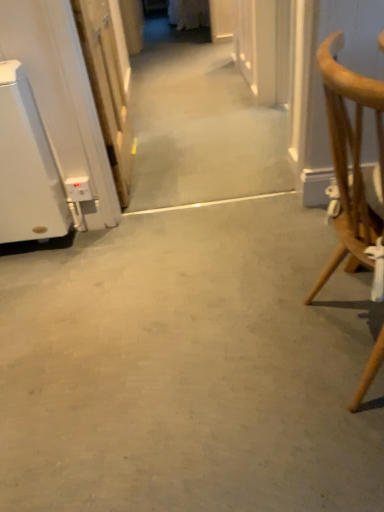
Image resolution: width=384 pixels, height=512 pixels. What do you see at coordinates (351, 156) in the screenshot?
I see `light brown wooden chair at right` at bounding box center [351, 156].

In order to click on light brown wooden chair at right in this screenshot , I will do `click(351, 156)`.

Is gray concrete floor at center oriented away from light brown wooden chair at right?

No, gray concrete floor at center's orientation is not away from light brown wooden chair at right.

Is gray concrete floor at center next to light brown wooden chair at right?

No, gray concrete floor at center is not in contact with light brown wooden chair at right.

From the image's perspective, is gray concrete floor at center above or below light brown wooden chair at right?

gray concrete floor at center is below light brown wooden chair at right.

Can you tell me how much gray concrete floor at center and light brown wooden chair at right differ in facing direction?

89 degrees.

Considering the positions of objects white glossy door at left and gray concrete floor at center in the image provided, who is behind, white glossy door at left or gray concrete floor at center?

white glossy door at left is more distant.

Can you confirm if white glossy door at left is smaller than gray concrete floor at center?

Indeed, white glossy door at left has a smaller size compared to gray concrete floor at center.

Identify the location of door lying on the left of gray concrete floor at center. point(107,88).

From a real-world perspective, is white glossy door at left physically above gray concrete floor at center?

Yes.

Between light brown wooden chair at right and white glossy door at left, which one appears on the right side from the viewer's perspective?

From the viewer's perspective, light brown wooden chair at right appears more on the right side.

How many degrees apart are the facing directions of light brown wooden chair at right and white glossy door at left?

The facing directions of light brown wooden chair at right and white glossy door at left are 1.3 degrees apart.

From the image's perspective, between light brown wooden chair at right and white glossy door at left, which one is located above?

white glossy door at left is shown above in the image.

Measure the distance between light brown wooden chair at right and white glossy door at left.

light brown wooden chair at right is 3.79 feet from white glossy door at left.

Looking at this image, from a real-world perspective, is gray concrete floor at center positioned over white glossy door at left based on gravity?

No, from a real-world perspective, gray concrete floor at center is not above white glossy door at left.

From the image's perspective, is gray concrete floor at center under white glossy door at left?

Indeed, from the image's perspective, gray concrete floor at center is shown beneath white glossy door at left.

Identify the location of door behind the gray concrete floor at center. The height and width of the screenshot is (512, 384). (107, 88).

Is gray concrete floor at center shorter than white glossy door at left?

Yes.

Between white glossy door at left and light brown wooden chair at right, which one appears on the left side from the viewer's perspective?

white glossy door at left.

Can you confirm if white glossy door at left is thinner than light brown wooden chair at right?

Correct, the width of white glossy door at left is less than that of light brown wooden chair at right.

Which object is closer to the camera, white glossy door at left or light brown wooden chair at right?

light brown wooden chair at right is more forward.

Is point (87, 70) positioned before point (381, 94)?

That is False.

Between light brown wooden chair at right and gray concrete floor at center, which one has less height?

gray concrete floor at center is shorter.

Who is bigger, light brown wooden chair at right or gray concrete floor at center?

light brown wooden chair at right.

Which object is closer to the camera, light brown wooden chair at right or gray concrete floor at center?

light brown wooden chair at right is more forward.

This screenshot has height=512, width=384. What are the coordinates of `chair that appears above the gray concrete floor at center (from a real-world perspective)` in the screenshot? It's located at (351, 156).

Image resolution: width=384 pixels, height=512 pixels. Find the location of `concrete located below the light brown wooden chair at right (from the image's perspective)`. concrete located below the light brown wooden chair at right (from the image's perspective) is located at coordinates (189, 368).

At what (x,y) coordinates should I click in order to perform the action: click on concrete below the white glossy door at left (from a real-world perspective). Please return your answer as a coordinate pair (x, y). This screenshot has height=512, width=384. Looking at the image, I should click on (189, 368).

Estimate the real-world distances between objects in this image. Which object is further from white glossy door at left, light brown wooden chair at right or gray concrete floor at center?

light brown wooden chair at right lies further to white glossy door at left than the other object.

When comparing their distances from gray concrete floor at center, does light brown wooden chair at right or white glossy door at left seem closer?

light brown wooden chair at right is closer to gray concrete floor at center.

Based on their spatial positions, is gray concrete floor at center or light brown wooden chair at right further from white glossy door at left?

light brown wooden chair at right lies further to white glossy door at left than the other object.

Looking at this image, estimate the real-world distances between objects in this image. Which object is further from light brown wooden chair at right, white glossy door at left or gray concrete floor at center?

Based on the image, white glossy door at left appears to be further to light brown wooden chair at right.

Which object lies further to the anchor point light brown wooden chair at right, gray concrete floor at center or white glossy door at left?

The object further to light brown wooden chair at right is white glossy door at left.

Based on their spatial positions, is white glossy door at left or light brown wooden chair at right further from gray concrete floor at center?

The object further to gray concrete floor at center is white glossy door at left.

The width and height of the screenshot is (384, 512). In order to click on chair between white glossy door at left and gray concrete floor at center in the vertical direction in this screenshot , I will do `click(351, 156)`.